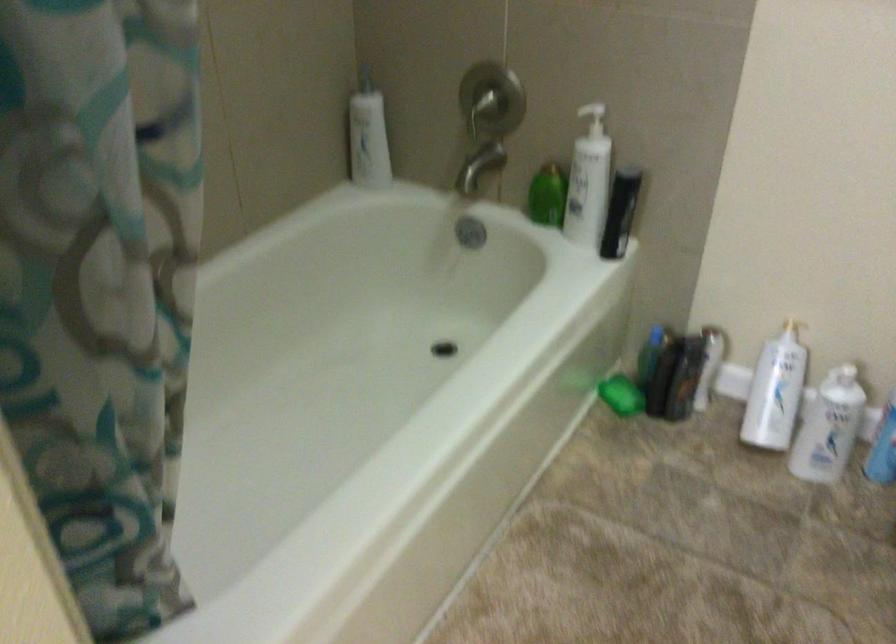
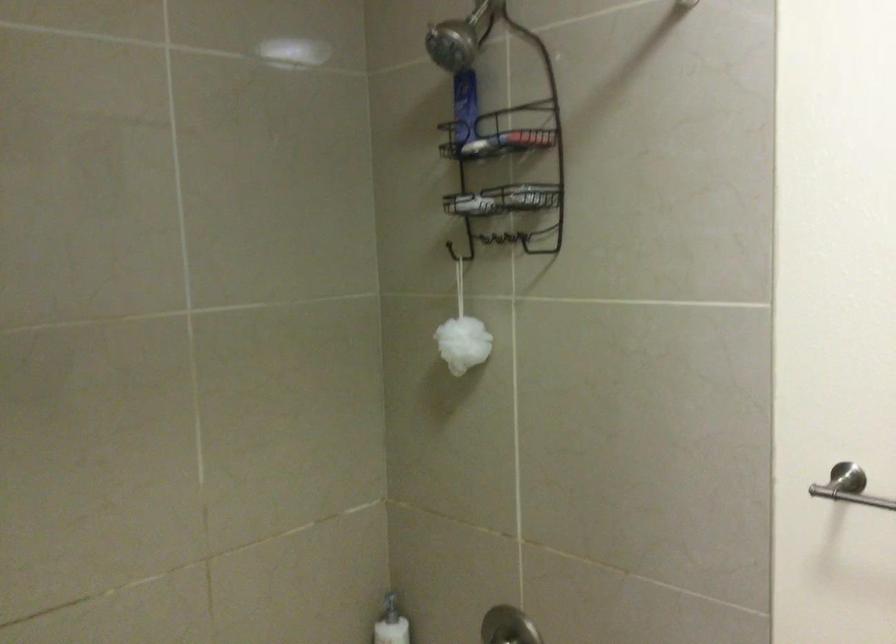
The first image is from the beginning of the video and the second image is from the end. How did the camera likely rotate when shooting the video?

The camera's rotation is toward left-up.